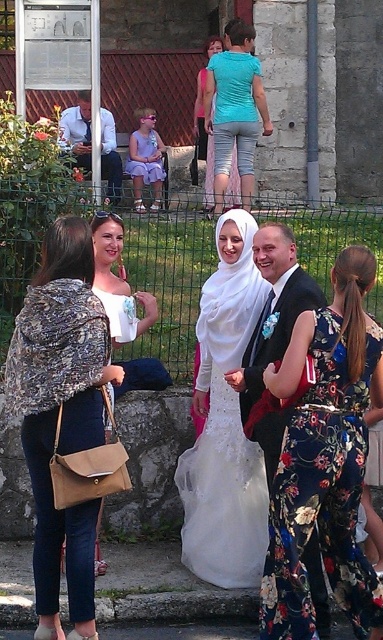
Question: Which point is farther from the camera taking this photo?

Choices:
 (A) (252, 262)
 (B) (242, 364)
 (C) (73, 116)
 (D) (63, 380)

Answer: (C)

Question: Is white satin wedding dress at center in front of white shirt at center?

Choices:
 (A) yes
 (B) no

Answer: (A)

Question: Which of the following is the closest to the observer?

Choices:
 (A) (235, 268)
 (B) (109, 186)
 (C) (24, 323)

Answer: (C)

Question: Which point is farther to the camera?

Choices:
 (A) click(238, 84)
 (B) click(88, 145)
 (C) click(217, 282)
 (D) click(242, 406)

Answer: (B)

Question: Can you confirm if shiny black suit at center is positioned to the left of matte black suit at center?

Choices:
 (A) no
 (B) yes

Answer: (A)

Question: Is white satin wedding dress at center thinner than matte black suit at center?

Choices:
 (A) no
 (B) yes

Answer: (B)